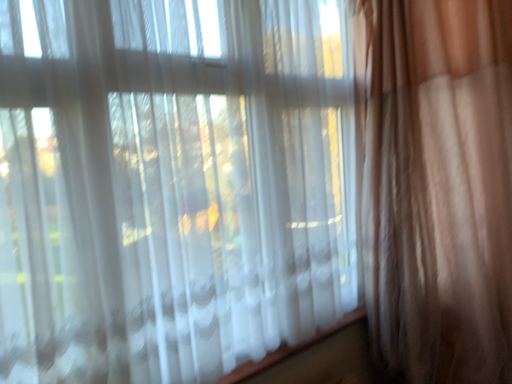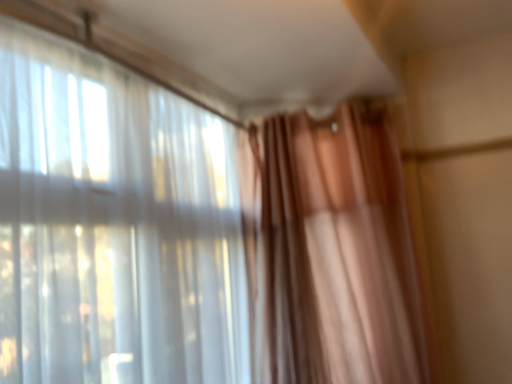
Question: How did the camera likely rotate when shooting the video?

Choices:
 (A) rotated upward
 (B) rotated downward

Answer: (A)